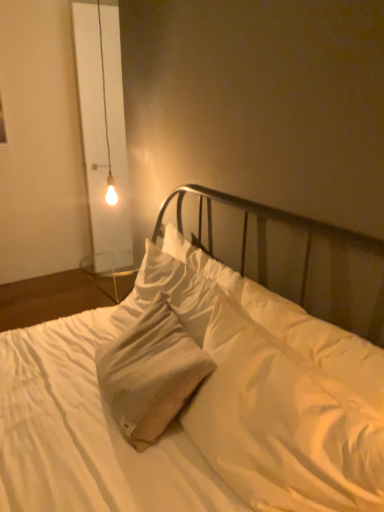
Question: Is white cotton bed at center beside white cotton pillow at center?

Choices:
 (A) yes
 (B) no

Answer: (B)

Question: Is white cotton bed at center smaller than white cotton pillow at center?

Choices:
 (A) no
 (B) yes

Answer: (A)

Question: From a real-world perspective, is white cotton bed at center beneath white cotton pillow at center?

Choices:
 (A) yes
 (B) no

Answer: (A)

Question: Does white cotton bed at center appear on the right side of white cotton pillow at center?

Choices:
 (A) no
 (B) yes

Answer: (A)

Question: Is white cotton bed at center shorter than white cotton pillow at center?

Choices:
 (A) yes
 (B) no

Answer: (B)

Question: Does white cotton bed at center have a greater height compared to white cotton pillow at center?

Choices:
 (A) no
 (B) yes

Answer: (B)

Question: From a real-world perspective, is white cotton bed at center located higher than matte glass bulb at upper left?

Choices:
 (A) no
 (B) yes

Answer: (A)

Question: Can you confirm if white cotton bed at center is positioned to the right of matte glass bulb at upper left?

Choices:
 (A) no
 (B) yes

Answer: (B)

Question: Is white cotton bed at center surrounding matte glass bulb at upper left?

Choices:
 (A) yes
 (B) no

Answer: (B)

Question: Considering the relative positions of white cotton bed at center and matte glass bulb at upper left in the image provided, is white cotton bed at center behind matte glass bulb at upper left?

Choices:
 (A) no
 (B) yes

Answer: (A)

Question: Is white cotton bed at center positioned far away from matte glass bulb at upper left?

Choices:
 (A) no
 (B) yes

Answer: (B)

Question: Could you tell me if white cotton bed at center is facing matte glass bulb at upper left?

Choices:
 (A) yes
 (B) no

Answer: (B)

Question: Is white cotton pillow at center facing away from matte glass bulb at upper left?

Choices:
 (A) yes
 (B) no

Answer: (B)